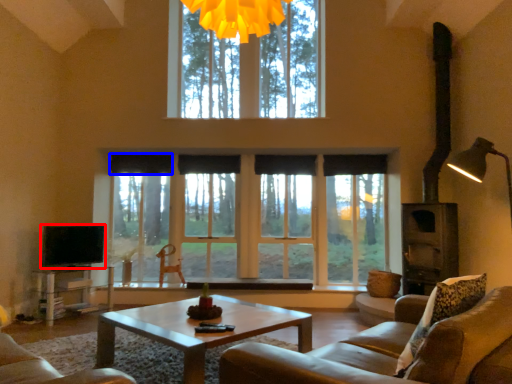
Question: Among these objects, which one is nearest to the camera, level (highlighted by a red box) or curtain (highlighted by a blue box)?

Choices:
 (A) level
 (B) curtain

Answer: (A)